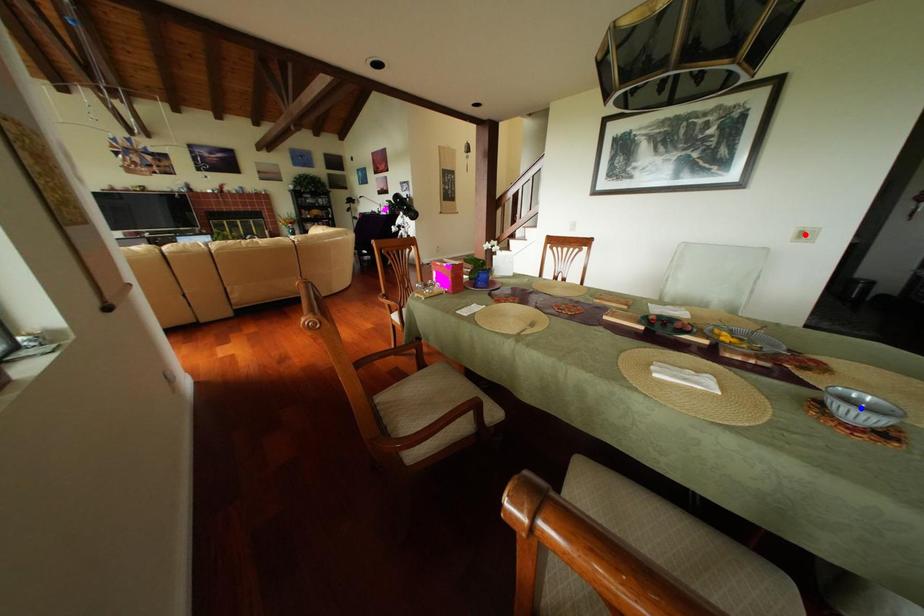
Question: Two points are marked on the image. Which point is closer to the camera?

Choices:
 (A) Blue point is closer.
 (B) Red point is closer.

Answer: (A)